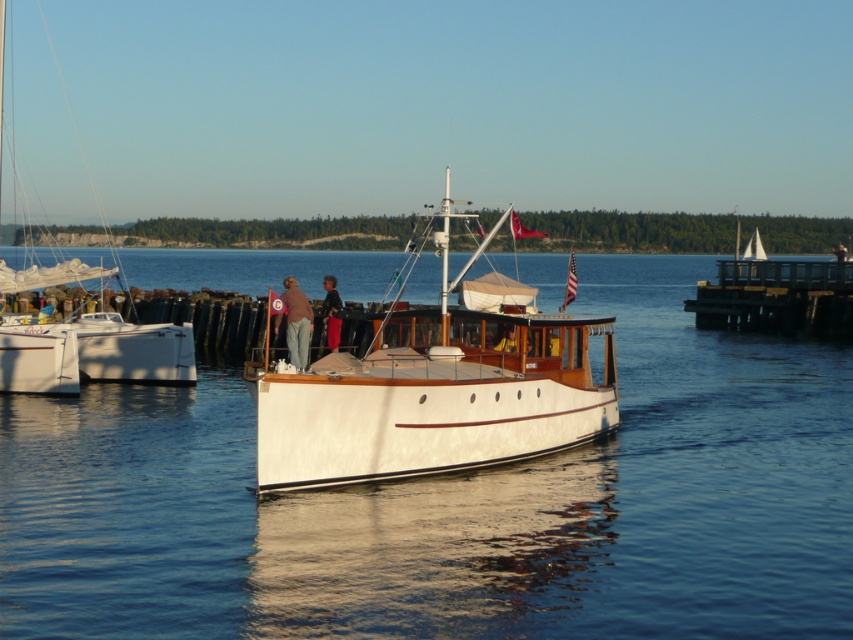
Which of these two, light brown pants at center or dark brown leather pants at center, stands taller?

With more height is dark brown leather pants at center.

Does light brown pants at center appear on the left side of dark brown leather pants at center?

No, light brown pants at center is not to the left of dark brown leather pants at center.

Image resolution: width=853 pixels, height=640 pixels. Find the location of `light brown pants at center`. light brown pants at center is located at coordinates (296, 323).

Can you confirm if white smooth water at center is wider than dark brown leather pants at center?

Yes.

Who is shorter, white smooth water at center or dark brown leather pants at center?

dark brown leather pants at center

Locate an element on the screen. Image resolution: width=853 pixels, height=640 pixels. white smooth water at center is located at coordinates (454, 506).

Between white polished wood boat at center and dark brown leather pants at center, which one is positioned lower?

dark brown leather pants at center

Which of these two, white polished wood boat at center or dark brown leather pants at center, stands taller?

Standing taller between the two is white polished wood boat at center.

Which is behind, point (479, 413) or point (326, 294)?

Point (326, 294)

Identify the location of white polished wood boat at center. The width and height of the screenshot is (853, 640). (436, 384).